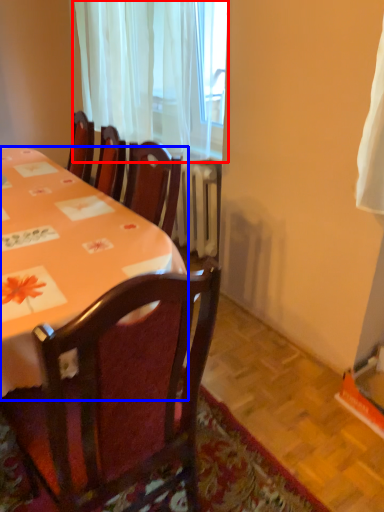
Question: Which object appears farthest to the camera in this image, curtain (highlighted by a red box) or desk (highlighted by a blue box)?

Choices:
 (A) curtain
 (B) desk

Answer: (A)